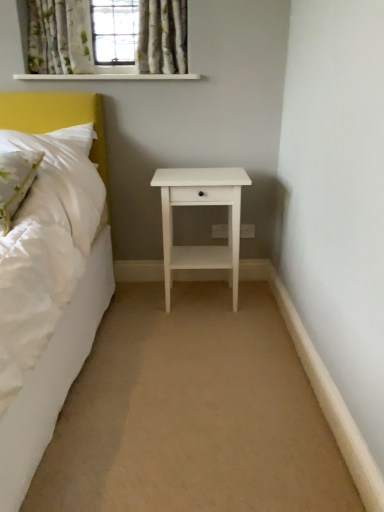
Identify the location of blank space to the left of white matte nightstand at center. This screenshot has height=512, width=384. (130, 311).